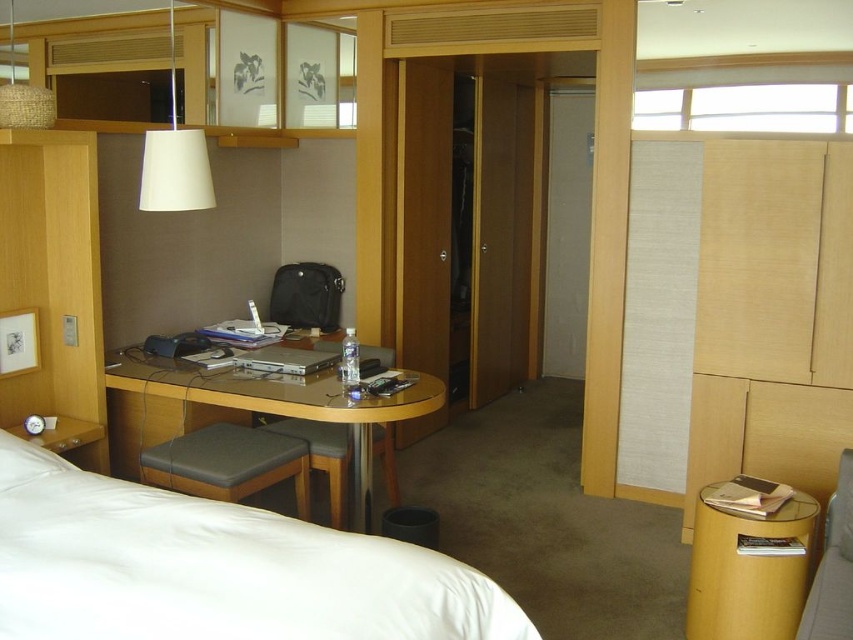
Question: Which of the following is the closest to the observer?

Choices:
 (A) matte beige lampshade at upper left
 (B) wooden polished table at center
 (C) matte gray cushioned chair at lower right

Answer: (C)

Question: Among these points, which one is nearest to the camera?

Choices:
 (A) (138, 596)
 (B) (334, 492)
 (C) (190, 472)

Answer: (A)

Question: Can you confirm if matte gray cushioned stool at center is bigger than matte gray cushioned chair at lower right?

Choices:
 (A) yes
 (B) no

Answer: (A)

Question: Where is matte gray cushioned stool at center located in relation to matte gray cushioned chair at lower right in the image?

Choices:
 (A) right
 (B) left

Answer: (B)

Question: Which point appears closest to the camera in this image?

Choices:
 (A) (138, 500)
 (B) (389, 440)

Answer: (A)

Question: Can you confirm if white matte lampshade at upper left is positioned above matte gray cushioned chair at lower right?

Choices:
 (A) yes
 (B) no

Answer: (A)